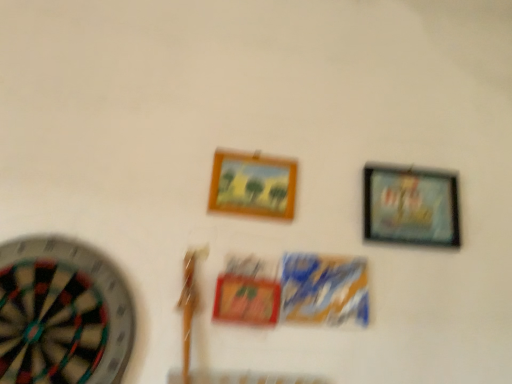
Question: Does multicolored felt dartboard at left appear on the right side of wooden frame at center, which is the second picture frame from right to left?

Choices:
 (A) yes
 (B) no

Answer: (B)

Question: Does multicolored felt dartboard at left have a smaller size compared to wooden frame at center, which is the second picture frame from right to left?

Choices:
 (A) yes
 (B) no

Answer: (B)

Question: Is multicolored felt dartboard at left located outside wooden frame at center, which is counted as the first picture frame, starting from the left?

Choices:
 (A) yes
 (B) no

Answer: (A)

Question: Does multicolored felt dartboard at left come in front of wooden frame at center, which is the second picture frame from right to left?

Choices:
 (A) yes
 (B) no

Answer: (A)

Question: Is multicolored felt dartboard at left aimed at wooden frame at center, which is the second picture frame from right to left?

Choices:
 (A) no
 (B) yes

Answer: (A)

Question: Does multicolored felt dartboard at left have a larger size compared to wooden frame at center, which is counted as the first picture frame, starting from the left?

Choices:
 (A) yes
 (B) no

Answer: (A)

Question: Does wooden frame at center, which is counted as the first picture frame, starting from the left, turn towards multicolored felt dartboard at left?

Choices:
 (A) yes
 (B) no

Answer: (B)

Question: Is wooden frame at center, which is counted as the first picture frame, starting from the left, far from multicolored felt dartboard at left?

Choices:
 (A) yes
 (B) no

Answer: (B)

Question: Considering the relative sizes of wooden frame at center, which is counted as the first picture frame, starting from the left, and multicolored felt dartboard at left in the image provided, is wooden frame at center, which is counted as the first picture frame, starting from the left, bigger than multicolored felt dartboard at left?

Choices:
 (A) yes
 (B) no

Answer: (B)

Question: From the image's perspective, would you say wooden frame at center, which is counted as the first picture frame, starting from the left, is shown under multicolored felt dartboard at left?

Choices:
 (A) yes
 (B) no

Answer: (B)

Question: Does wooden frame at center, which is counted as the first picture frame, starting from the left, appear on the right side of multicolored felt dartboard at left?

Choices:
 (A) no
 (B) yes

Answer: (B)

Question: From a real-world perspective, is wooden frame at center, which is the second picture frame from right to left, physically below multicolored felt dartboard at left?

Choices:
 (A) yes
 (B) no

Answer: (B)

Question: From a real-world perspective, is wooden frame at center, which is the second picture frame from right to left, physically below metallic silver picture frame at upper right, the 2th picture frame positioned from the left?

Choices:
 (A) yes
 (B) no

Answer: (B)